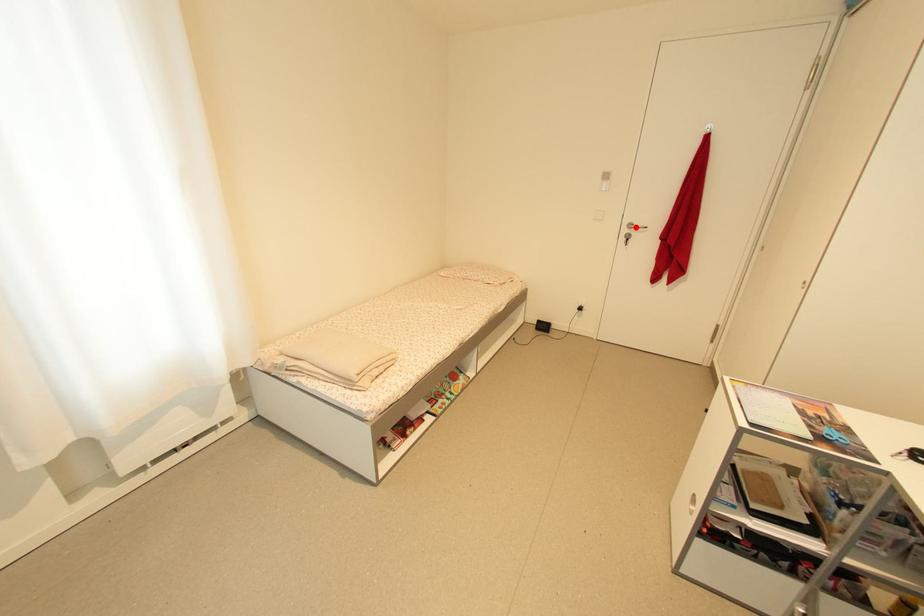
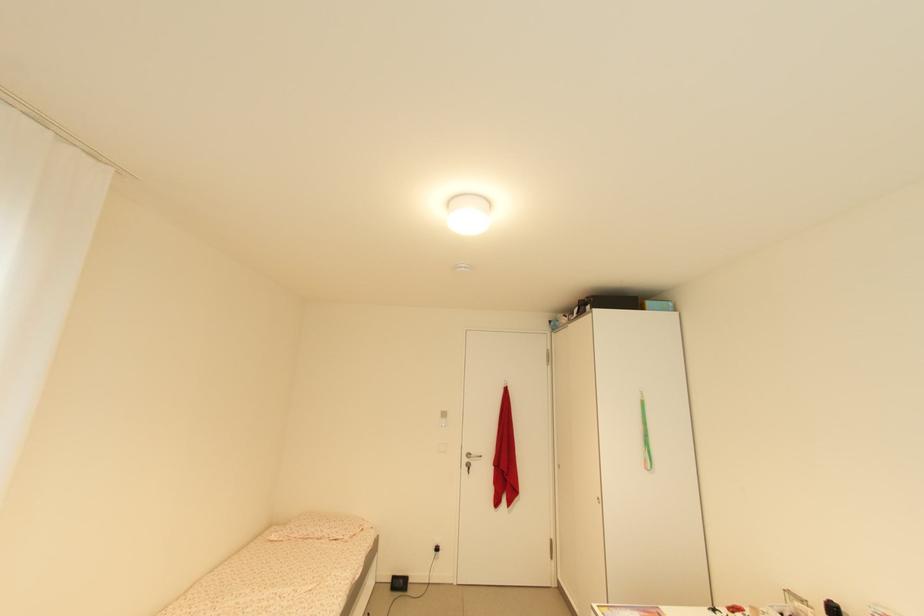
Find the pixel in the second image that matches the highlighted location in the first image.

(473, 456)